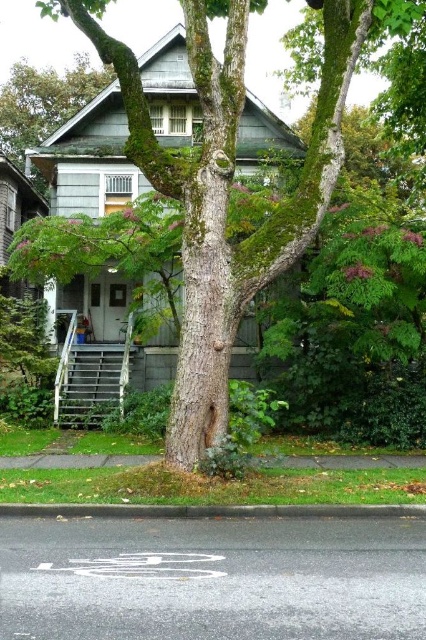
Find the location of a particular element. This screenshot has width=426, height=640. green mossy tree at center is located at coordinates (230, 182).

Who is more distant from viewer, (357, 4) or (20, 138)?

The point (20, 138) is behind.

Where is `green mossy tree at center`? The image size is (426, 640). green mossy tree at center is located at coordinates (230, 182).